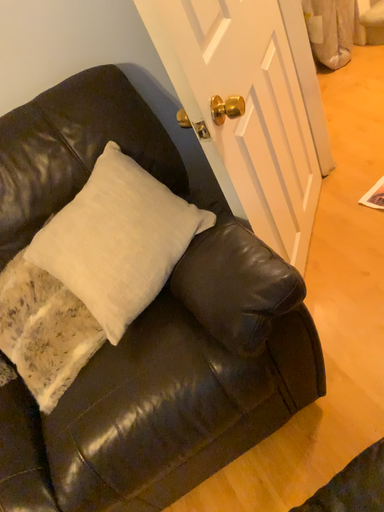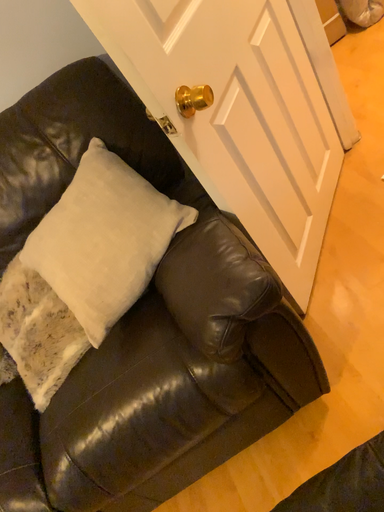
Question: How did the camera likely rotate when shooting the video?

Choices:
 (A) rotated left
 (B) rotated right

Answer: (A)